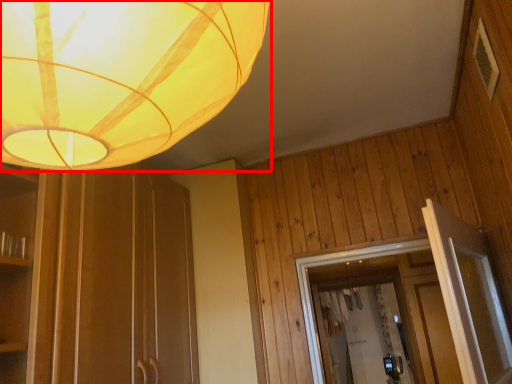
Question: In this image, where is lamp (annotated by the red box) located relative to panel?

Choices:
 (A) left
 (B) right

Answer: (A)